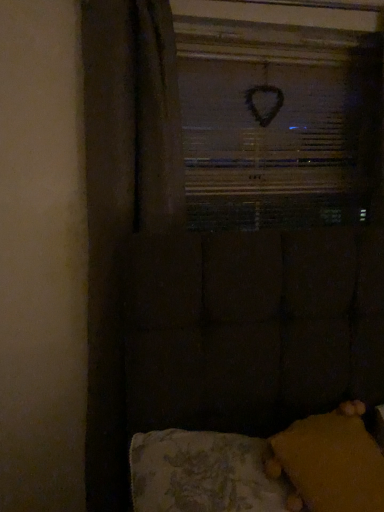
Describe the element at coordinates (261, 469) in the screenshot. I see `velvet yellow cushion at lower right` at that location.

Where is `black matte heart at upper center`? black matte heart at upper center is located at coordinates (278, 123).

Do you think yellow fuzzy pillow at lower right is within black matte heart at upper center, or outside of it?

yellow fuzzy pillow at lower right exists outside the volume of black matte heart at upper center.

Is yellow fuzzy pillow at lower right in contact with black matte heart at upper center?

yellow fuzzy pillow at lower right and black matte heart at upper center are not in contact.

At what (x,y) coordinates should I click in order to perform the action: click on pillow in front of the black matte heart at upper center. Please return your answer as a coordinate pair (x, y). Looking at the image, I should click on (332, 463).

In the scene shown: Is yellow fuzzy pillow at lower right thinner than black matte heart at upper center?

Incorrect, the width of yellow fuzzy pillow at lower right is not less than that of black matte heart at upper center.

Does velvet yellow cushion at lower right touch black matte heart at upper center?

No, velvet yellow cushion at lower right is not in contact with black matte heart at upper center.

Considering the relative sizes of velvet yellow cushion at lower right and black matte heart at upper center in the image provided, is velvet yellow cushion at lower right thinner than black matte heart at upper center?

Incorrect, the width of velvet yellow cushion at lower right is not less than that of black matte heart at upper center.

Which point is more distant from viewer, (364, 494) or (299, 159)?

Positioned behind is point (299, 159).

Which is behind, point (234, 122) or point (359, 481)?

The point (234, 122) is farther.

Is black matte heart at upper center with velvet yellow cushion at lower right?

black matte heart at upper center is not next to velvet yellow cushion at lower right, and they're not touching.

Can you tell me how much black matte heart at upper center and velvet yellow cushion at lower right differ in facing direction?

The angle between the facing direction of black matte heart at upper center and the facing direction of velvet yellow cushion at lower right is 1.07 degrees.

Which object is positioned more to the left, black matte heart at upper center or velvet yellow cushion at lower right?

From the viewer's perspective, velvet yellow cushion at lower right appears more on the left side.

Would you say velvet yellow cushion at lower right contains yellow fuzzy pillow at lower right?

Yes, yellow fuzzy pillow at lower right is a part of velvet yellow cushion at lower right.

Does velvet yellow cushion at lower right turn towards yellow fuzzy pillow at lower right?

Yes, velvet yellow cushion at lower right is oriented towards yellow fuzzy pillow at lower right.

Is velvet yellow cushion at lower right placed right next to yellow fuzzy pillow at lower right?

Yes, velvet yellow cushion at lower right is next to yellow fuzzy pillow at lower right.

Is black matte heart at upper center wider than yellow fuzzy pillow at lower right?

In fact, black matte heart at upper center might be narrower than yellow fuzzy pillow at lower right.

Is black matte heart at upper center positioned with its back to yellow fuzzy pillow at lower right?

No, black matte heart at upper center is not facing the opposite direction of yellow fuzzy pillow at lower right.

In terms of size, does black matte heart at upper center appear bigger or smaller than yellow fuzzy pillow at lower right?

In the image, black matte heart at upper center appears to be larger than yellow fuzzy pillow at lower right.

From the image's perspective, relative to yellow fuzzy pillow at lower right, is black matte heart at upper center above or below?

Clearly, from the image's perspective, black matte heart at upper center is above yellow fuzzy pillow at lower right.

Is yellow fuzzy pillow at lower right facing away from velvet yellow cushion at lower right?

Absolutely, yellow fuzzy pillow at lower right is directed away from velvet yellow cushion at lower right.

Considering the relative sizes of yellow fuzzy pillow at lower right and velvet yellow cushion at lower right in the image provided, is yellow fuzzy pillow at lower right bigger than velvet yellow cushion at lower right?

Actually, yellow fuzzy pillow at lower right might be smaller than velvet yellow cushion at lower right.

Considering the points (350, 458) and (313, 426), which point is behind, point (350, 458) or point (313, 426)?

Positioned behind is point (313, 426).

You are a GUI agent. You are given a task and a screenshot of the screen. Output one action in this format:
    pyautogui.click(x=<x>, y=<y>)
    Task: Click on the window screen above the yellow fuzzy pillow at lower right (from a real-world perspective)
    
    Given the screenshot: What is the action you would take?
    pyautogui.click(x=278, y=123)

Image resolution: width=384 pixels, height=512 pixels. I want to click on window screen above the velvet yellow cushion at lower right (from the image's perspective), so click(278, 123).

Looking at this image, estimate the real-world distances between objects in this image. Which object is closer to yellow fuzzy pillow at lower right, black matte heart at upper center or velvet yellow cushion at lower right?

velvet yellow cushion at lower right.

Estimate the real-world distances between objects in this image. Which object is further from velvet yellow cushion at lower right, black matte heart at upper center or yellow fuzzy pillow at lower right?

Among the two, black matte heart at upper center is located further to velvet yellow cushion at lower right.

From the image, which object appears to be farther from velvet yellow cushion at lower right, yellow fuzzy pillow at lower right or black matte heart at upper center?

Among the two, black matte heart at upper center is located further to velvet yellow cushion at lower right.

From the image, which object appears to be farther from black matte heart at upper center, velvet yellow cushion at lower right or yellow fuzzy pillow at lower right?

Based on the image, yellow fuzzy pillow at lower right appears to be further to black matte heart at upper center.

Based on the photo, looking at the image, which one is located further to yellow fuzzy pillow at lower right, velvet yellow cushion at lower right or black matte heart at upper center?

Answer: black matte heart at upper center is further to yellow fuzzy pillow at lower right.

When comparing their distances from black matte heart at upper center, does yellow fuzzy pillow at lower right or velvet yellow cushion at lower right seem closer?

velvet yellow cushion at lower right is positioned closer to the anchor black matte heart at upper center.

This screenshot has height=512, width=384. I want to click on pillow between black matte heart at upper center and velvet yellow cushion at lower right from top to bottom, so click(332, 463).